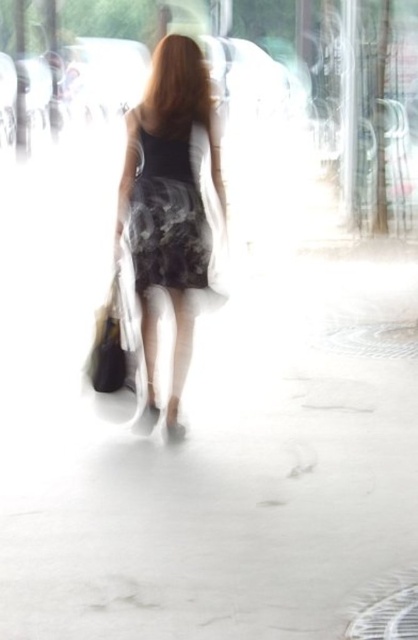
You are a photographer analyzing the image. The camera is at a certain position. Where is the floral dress at center located in terms of coordinates?

The floral dress at center is located at coordinates point (168, 205).

Consider the image. You are a photographer trying to focus on the floral dress at center in a blurred image. The dress is positioned at coordinates 0.322 on the x and 0.404 on the y. If your focus area is a square centered at the same point with a side length of 0.2, will the entire dress fit within the focus area?

The floral dress at center is located at point (168, 205). The focus area is a square with side length 0.2 centered at the same coordinates. Since the dress is at the center of the square, it will fit within the focus area as long as its dimensions do not exceed the square. However, without knowing the dress size, we can only confirm its central position within the focus area.